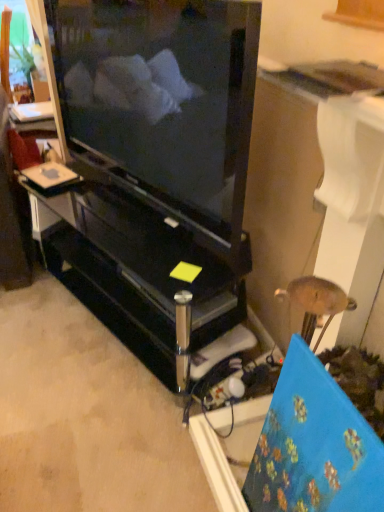
The image size is (384, 512). What do you see at coordinates (164, 104) in the screenshot?
I see `black glossy television at center` at bounding box center [164, 104].

Measure the distance between point (117,108) and camera.

Point (117,108) and camera are 7.36 feet apart from each other.

Where is `black glossy television at center`? The image size is (384, 512). black glossy television at center is located at coordinates (164, 104).

Locate an element on the screen. black glossy entertainment center at center is located at coordinates (136, 271).

The height and width of the screenshot is (512, 384). What do you see at coordinates (136, 271) in the screenshot?
I see `black glossy entertainment center at center` at bounding box center [136, 271].

This screenshot has height=512, width=384. Identify the location of black glossy television at center. (164, 104).

Does black glossy entertainment center at center appear on the left side of black glossy television at center?

Indeed, black glossy entertainment center at center is positioned on the left side of black glossy television at center.

Considering the positions of objects black glossy entertainment center at center and black glossy television at center in the image provided, who is in front, black glossy entertainment center at center or black glossy television at center?

black glossy television at center.

Between point (137, 254) and point (209, 16), which one is positioned behind?

Positioned behind is point (137, 254).

From the image's perspective, would you say black glossy entertainment center at center is positioned over black glossy television at center?

Incorrect, from the image's perspective, black glossy entertainment center at center is lower than black glossy television at center.

From a real-world perspective, does black glossy entertainment center at center stand above black glossy television at center?

Incorrect, from a real-world perspective, black glossy entertainment center at center is lower than black glossy television at center.

From the picture: Which object is wider, black glossy entertainment center at center or black glossy television at center?

black glossy entertainment center at center is wider.

Can you confirm if black glossy entertainment center at center is shorter than black glossy television at center?

Yes.

Is black glossy entertainment center at center bigger than black glossy television at center?

Indeed, black glossy entertainment center at center has a larger size compared to black glossy television at center.

Is black glossy television at center inside black glossy entertainment center at center?

Definitely not — black glossy television at center is not inside black glossy entertainment center at center.

Would you consider black glossy entertainment center at center to be distant from black glossy television at center?

Actually, black glossy entertainment center at center and black glossy television at center are a little close together.

Is black glossy entertainment center at center facing away from black glossy television at center?

No, black glossy television at center is not at the back of black glossy entertainment center at center.

How many degrees apart are the facing directions of black glossy entertainment center at center and black glossy television at center?

1.65 degrees separate the facing orientations of black glossy entertainment center at center and black glossy television at center.

How far apart are black glossy entertainment center at center and black glossy television at center?

The distance of black glossy entertainment center at center from black glossy television at center is 13.00 inches.

Identify the location of television above the black glossy entertainment center at center (from a real-world perspective). (164, 104).

Considering the relative positions of black glossy television at center and black glossy entertainment center at center in the image provided, is black glossy television at center to the left or to the right of black glossy entertainment center at center?

In the image, black glossy television at center appears on the right side of black glossy entertainment center at center.

Which is in front, black glossy television at center or black glossy entertainment center at center?

black glossy television at center is more forward.

Which is in front, point (104, 61) or point (123, 211)?

The point (123, 211) is closer to the camera.

From the image's perspective, which is above, black glossy television at center or black glossy entertainment center at center?

From the image's view, black glossy television at center is above.

From a real-world perspective, between black glossy television at center and black glossy entertainment center at center, who is vertically lower?

From a 3D spatial view, black glossy entertainment center at center is below.

Does black glossy television at center have a greater width compared to black glossy entertainment center at center?

No.

From their relative heights in the image, would you say black glossy television at center is taller or shorter than black glossy entertainment center at center?

In the image, black glossy television at center appears to be taller than black glossy entertainment center at center.

Does black glossy television at center have a larger size compared to black glossy entertainment center at center?

Actually, black glossy television at center might be smaller than black glossy entertainment center at center.

Is black glossy television at center spatially inside black glossy entertainment center at center, or outside of it?

black glossy television at center exists outside the volume of black glossy entertainment center at center.

Is black glossy television at center positioned far away from black glossy entertainment center at center?

No, black glossy television at center is not far from black glossy entertainment center at center.

Is black glossy television at center looking in the opposite direction of black glossy entertainment center at center?

No, black glossy television at center's orientation is not away from black glossy entertainment center at center.

Locate an element on the screen. furniture on the left of the black glossy television at center is located at coordinates pos(136,271).

Locate an element on the screen. The width and height of the screenshot is (384, 512). furniture that appears below the black glossy television at center (from a real-world perspective) is located at coordinates click(x=136, y=271).

Where is `television above the black glossy entertainment center at center (from a real-world perspective)`? The height and width of the screenshot is (512, 384). television above the black glossy entertainment center at center (from a real-world perspective) is located at coordinates (164, 104).